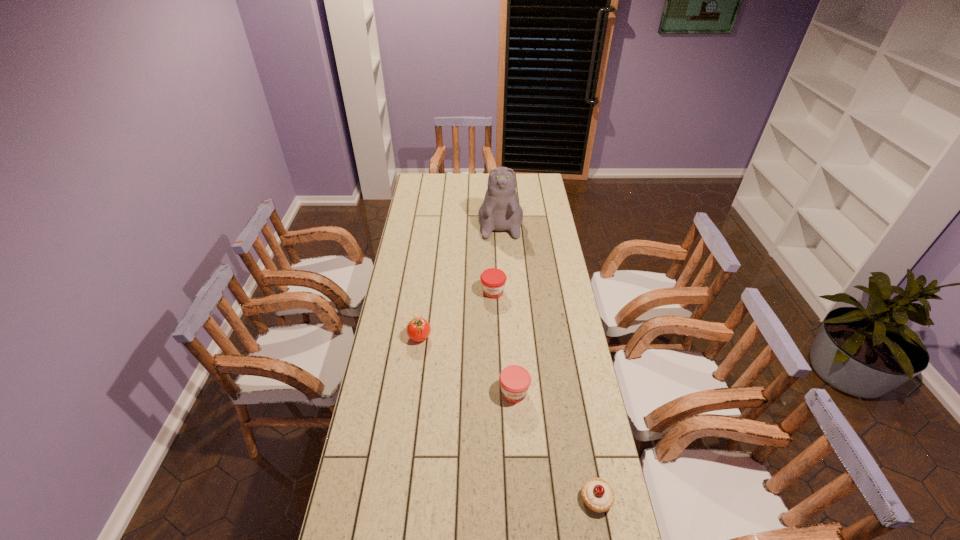
Where is `vacant area situated on the right of the leftmost object`? The width and height of the screenshot is (960, 540). vacant area situated on the right of the leftmost object is located at coordinates (505, 336).

The height and width of the screenshot is (540, 960). I want to click on vacant space situated on the front label of the fourth farthest object, so pos(519,466).

At what (x,y) coordinates should I click in order to perform the action: click on blank space located on the left of the shortest object. Please return your answer as a coordinate pair (x, y). Looking at the image, I should click on (470, 498).

The height and width of the screenshot is (540, 960). Find the location of `object that is at the left edge`. object that is at the left edge is located at coordinates (418, 329).

At what (x,y) coordinates should I click in order to perform the action: click on object located at the right edge. Please return your answer as a coordinate pair (x, y). Looking at the image, I should click on [x=597, y=494].

Identify the location of free space at the far edge of the desktop. The image size is (960, 540). coord(444,191).

The image size is (960, 540). Identify the location of vacant space at the left edge of the desktop. (x=431, y=215).

In the image, there is a desktop. Where is `vacant space at the right edge`? vacant space at the right edge is located at coordinates (547, 299).

At what (x,y) coordinates should I click in order to perform the action: click on free spot at the far right corner of the desktop. Please return your answer as a coordinate pair (x, y). The image size is (960, 540). Looking at the image, I should click on (529, 174).

Locate an element on the screen. The image size is (960, 540). unoccupied area between the tallest object and the farther jam is located at coordinates (496, 254).